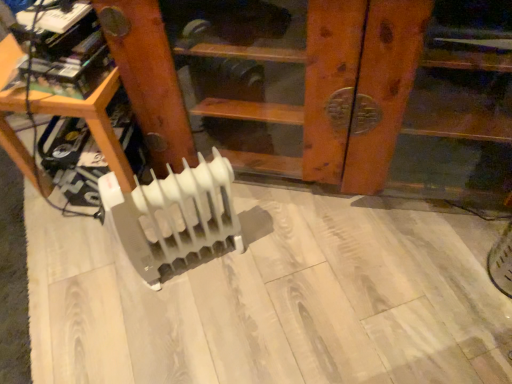
Question: Which direction should I rotate to look at white plastic radiator at center, which is the 1th furniture from right to left?

Choices:
 (A) left
 (B) right

Answer: (B)

Question: From the image's perspective, is white plastic radiator at center, which is the 1th furniture from right to left, beneath white plastic radiator at center?

Choices:
 (A) no
 (B) yes

Answer: (A)

Question: Can you confirm if white plastic radiator at center, which is the 1th furniture from right to left, is wider than white plastic radiator at center?

Choices:
 (A) yes
 (B) no

Answer: (A)

Question: Are white plastic radiator at center, which is the second furniture in left-to-right order, and white plastic radiator at center far apart?

Choices:
 (A) yes
 (B) no

Answer: (B)

Question: Does white plastic radiator at center, which is the second furniture in left-to-right order, have a greater height compared to white plastic radiator at center?

Choices:
 (A) no
 (B) yes

Answer: (B)

Question: Can we say white plastic radiator at center, which is the second furniture in left-to-right order, lies outside white plastic radiator at center?

Choices:
 (A) yes
 (B) no

Answer: (A)

Question: From the image's perspective, is white plastic radiator at center, which is the 1th furniture from right to left, located above white plastic radiator at center?

Choices:
 (A) yes
 (B) no

Answer: (A)

Question: From the image's perspective, is white plastic radiator at lower center, positioned as the 1th furniture in left-to-right order, on top of white plastic radiator at center?

Choices:
 (A) yes
 (B) no

Answer: (A)

Question: Can you confirm if white plastic radiator at lower center, which is the 2th furniture from right to left, is smaller than white plastic radiator at center?

Choices:
 (A) yes
 (B) no

Answer: (B)

Question: From the image's perspective, does white plastic radiator at lower center, positioned as the 1th furniture in left-to-right order, appear lower than white plastic radiator at center?

Choices:
 (A) yes
 (B) no

Answer: (B)

Question: Is white plastic radiator at lower center, which is the 2th furniture from right to left, with white plastic radiator at center?

Choices:
 (A) yes
 (B) no

Answer: (B)

Question: From a real-world perspective, does white plastic radiator at lower center, positioned as the 1th furniture in left-to-right order, stand above white plastic radiator at center?

Choices:
 (A) no
 (B) yes

Answer: (B)

Question: Does white plastic radiator at lower center, positioned as the 1th furniture in left-to-right order, have a larger size compared to white plastic radiator at center?

Choices:
 (A) yes
 (B) no

Answer: (A)

Question: Does white plastic radiator at center have a greater width compared to white plastic radiator at center, which is the second furniture in left-to-right order?

Choices:
 (A) yes
 (B) no

Answer: (B)